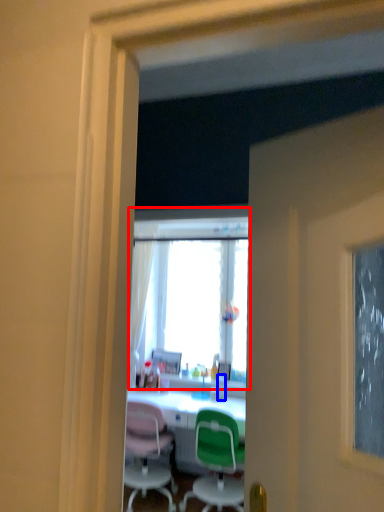
Question: Which object appears closest to the camera in this image, window (highlighted by a red box) or bottle (highlighted by a blue box)?

Choices:
 (A) window
 (B) bottle

Answer: (A)